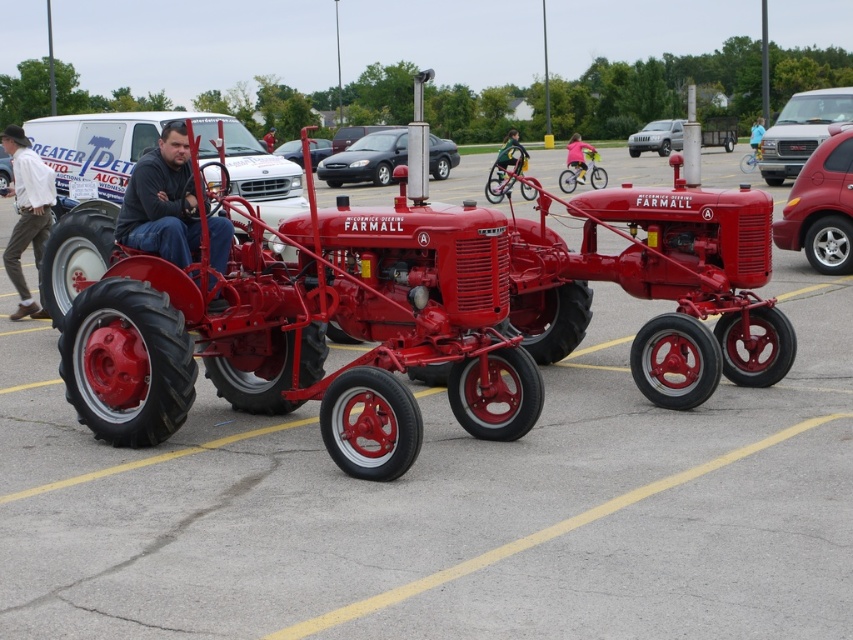
Question: Which point is farther to the camera?

Choices:
 (A) (328, 148)
 (B) (113, 371)
 (C) (666, 150)

Answer: (C)

Question: Where is metallic red car at right located in relation to brushed metal pants at lower left in the image?

Choices:
 (A) left
 (B) right

Answer: (B)

Question: Can you confirm if polished metal tractor at center is positioned below black glossy sedan at center?

Choices:
 (A) no
 (B) yes

Answer: (B)

Question: Which object is closer to the camera taking this photo?

Choices:
 (A) metallic red car at right
 (B) polished metal tractor at center
 (C) brushed metal pants at lower left
 (D) black glossy sedan at center

Answer: (B)

Question: Among these objects, which one is nearest to the camera?

Choices:
 (A) metallic silver suv at upper right
 (B) metallic red car at right
 (C) polished metal tractor at center
 (D) black glossy sedan at center

Answer: (C)

Question: Is matte black pants at center further to the viewer compared to black glossy sedan at center?

Choices:
 (A) no
 (B) yes

Answer: (A)